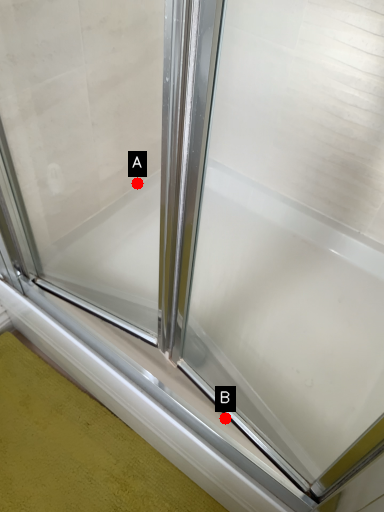
Question: Two points are circled on the image, labeled by A and B beside each circle. Which point is closer to the camera?

Choices:
 (A) A is closer
 (B) B is closer

Answer: (B)